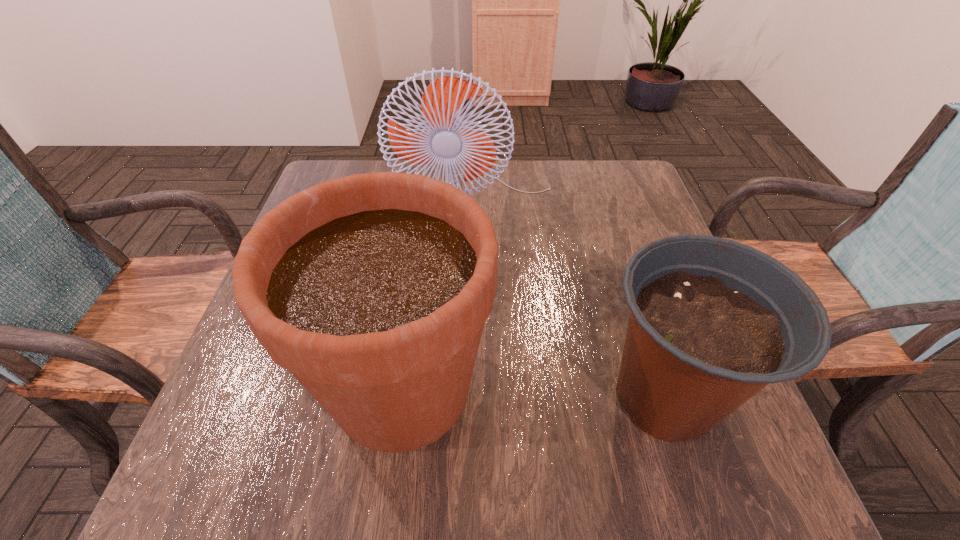
This screenshot has height=540, width=960. Find the location of `fan`. fan is located at coordinates (447, 137).

Identify the location of the tallest object. The width and height of the screenshot is (960, 540). [x=447, y=137].

This screenshot has width=960, height=540. Identify the location of the second tallest object. (372, 289).

Where is `the left flowerpot`? Image resolution: width=960 pixels, height=540 pixels. the left flowerpot is located at coordinates (372, 289).

Find the location of a particular element. This screenshot has height=540, width=960. the shorter flowerpot is located at coordinates [712, 321].

Where is `the right flowerpot`? Image resolution: width=960 pixels, height=540 pixels. the right flowerpot is located at coordinates (712, 321).

The image size is (960, 540). I want to click on vacant position located on the front-facing side of the fan, so click(481, 276).

Find the location of a particular element. The image size is (960, 540). blank space located 0.130m on the right of the taller flowerpot is located at coordinates (564, 388).

Find the location of `free space located 0.090m on the left of the shortest object`. free space located 0.090m on the left of the shortest object is located at coordinates (540, 397).

Where is `object that is at the far edge`? This screenshot has height=540, width=960. object that is at the far edge is located at coordinates (447, 137).